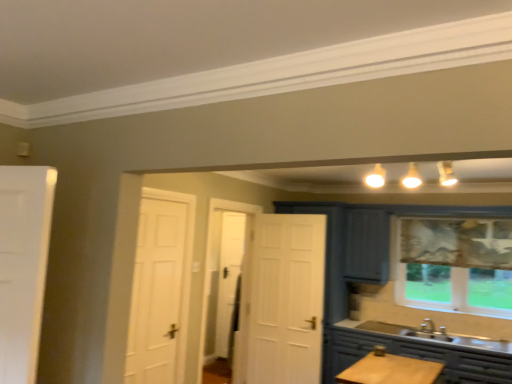
What do you see at coordinates (416, 354) in the screenshot? The height and width of the screenshot is (384, 512). I see `matte gray cabinet at lower right` at bounding box center [416, 354].

Identify the location of matte gray cabinet at lower right. This screenshot has width=512, height=384. (416, 354).

In the scene shown: Measure the distance between matte gray cabinet at lower right and camera.

matte gray cabinet at lower right is 3.38 meters away from camera.

Identify the location of transparent fabric window at right. (455, 265).

The height and width of the screenshot is (384, 512). Describe the element at coordinates (455, 265) in the screenshot. I see `transparent fabric window at right` at that location.

Identify the location of matte gray cabinet at lower right. (416, 354).

Is matte gray cabinet at lower right at the left side of transparent fabric window at right?

Yes, matte gray cabinet at lower right is to the left of transparent fabric window at right.

Is the position of matte gray cabinet at lower right more distant than that of transparent fabric window at right?

No, matte gray cabinet at lower right is in front of transparent fabric window at right.

Which is closer to the camera, (333, 327) or (466, 220)?

Point (333, 327) is closer to the camera than point (466, 220).

From the picture: From the image's perspective, which object appears higher, matte gray cabinet at lower right or transparent fabric window at right?

transparent fabric window at right is shown above in the image.

Consider the image. From a real-world perspective, which is physically below, matte gray cabinet at lower right or transparent fabric window at right?

matte gray cabinet at lower right, from a real-world perspective.

Considering the sizes of matte gray cabinet at lower right and transparent fabric window at right in the image, is matte gray cabinet at lower right wider or thinner than transparent fabric window at right?

In the image, matte gray cabinet at lower right appears to be wider than transparent fabric window at right.

Does matte gray cabinet at lower right have a lesser height compared to transparent fabric window at right?

Correct, matte gray cabinet at lower right is not as tall as transparent fabric window at right.

Between matte gray cabinet at lower right and transparent fabric window at right, which one has smaller size?

With smaller size is transparent fabric window at right.

Is matte gray cabinet at lower right inside or outside of transparent fabric window at right?

matte gray cabinet at lower right is outside transparent fabric window at right.

Are matte gray cabinet at lower right and transparent fabric window at right making contact?

They are not placed beside each other.

Is matte gray cabinet at lower right aimed at transparent fabric window at right?

No, matte gray cabinet at lower right does not turn towards transparent fabric window at right.

Image resolution: width=512 pixels, height=384 pixels. What are the coordinates of `window behind the matte gray cabinet at lower right` in the screenshot? It's located at (455, 265).

Is transparent fabric window at right to the left of matte gray cabinet at lower right from the viewer's perspective?

Incorrect, transparent fabric window at right is not on the left side of matte gray cabinet at lower right.

Which is behind, transparent fabric window at right or matte gray cabinet at lower right?

transparent fabric window at right is more distant.

Does point (439, 267) come in front of point (467, 366)?

No, it is behind (467, 366).

From the image's perspective, which is above, transparent fabric window at right or matte gray cabinet at lower right?

transparent fabric window at right, from the image's perspective.

From a real-world perspective, is transparent fabric window at right located higher than matte gray cabinet at lower right?

Yes.

Is transparent fabric window at right wider or thinner than matte gray cabinet at lower right?

Clearly, transparent fabric window at right has less width compared to matte gray cabinet at lower right.

Considering the sizes of objects transparent fabric window at right and matte gray cabinet at lower right in the image provided, who is taller, transparent fabric window at right or matte gray cabinet at lower right?

transparent fabric window at right is taller.

Considering the sizes of objects transparent fabric window at right and matte gray cabinet at lower right in the image provided, who is smaller, transparent fabric window at right or matte gray cabinet at lower right?

With smaller size is transparent fabric window at right.

Is matte gray cabinet at lower right completely or partially inside transparent fabric window at right?

No, matte gray cabinet at lower right is not inside transparent fabric window at right.

Is the surface of transparent fabric window at right in direct contact with matte gray cabinet at lower right?

No, transparent fabric window at right is not beside matte gray cabinet at lower right.

Is transparent fabric window at right facing away from matte gray cabinet at lower right?

No, matte gray cabinet at lower right is not at the back of transparent fabric window at right.

How many degrees apart are the facing directions of transparent fabric window at right and matte gray cabinet at lower right?

They differ by 0.00589 degrees in their facing directions.

The height and width of the screenshot is (384, 512). Identify the location of cabinetry in front of the transparent fabric window at right. (416, 354).

I want to click on cabinetry that appears below the transparent fabric window at right (from a real-world perspective), so (416, 354).

Locate an element on the screen. This screenshot has width=512, height=384. window that is above the matte gray cabinet at lower right (from a real-world perspective) is located at coordinates (455, 265).